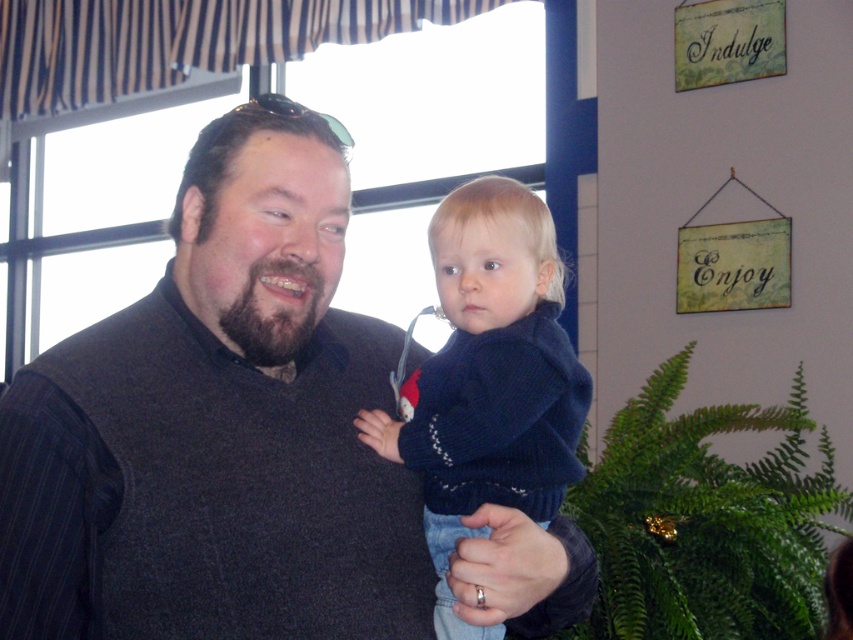
Which is more to the left, dark gray sweater at center or dark blue sweater at center?

From the viewer's perspective, dark gray sweater at center appears more on the left side.

This screenshot has width=853, height=640. Describe the element at coordinates (218, 426) in the screenshot. I see `dark gray sweater at center` at that location.

The height and width of the screenshot is (640, 853). What are the coordinates of `dark gray sweater at center` in the screenshot? It's located at (218, 426).